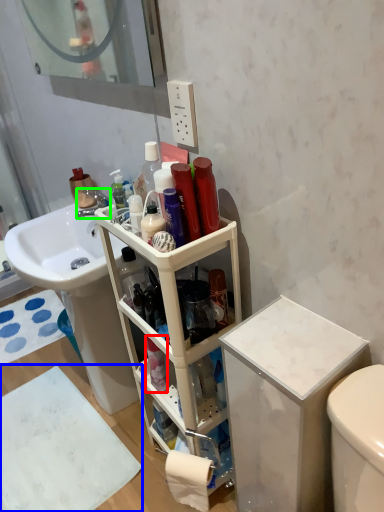
Question: Based on their relative distances, which object is nearer to toiletry (highlighted by a red box)? Choose from bath mat (highlighted by a blue box) and faucet (highlighted by a green box).

Choices:
 (A) bath mat
 (B) faucet

Answer: (A)